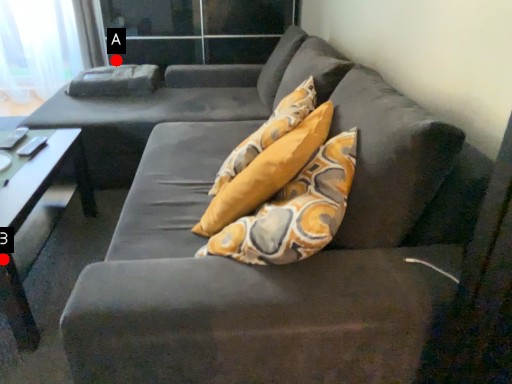
Question: Two points are circled on the image, labeled by A and B beside each circle. Which point is closer to the camera?

Choices:
 (A) A is closer
 (B) B is closer

Answer: (B)